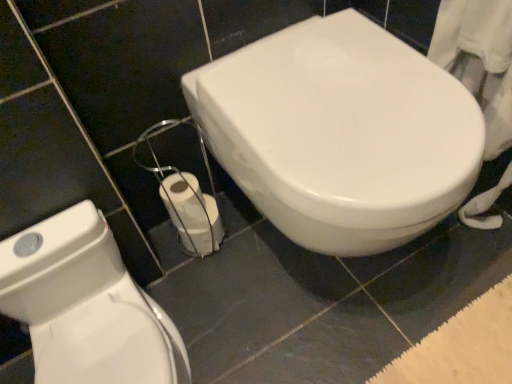
Question: Is white glossy toilet at lower left, the 2th toilet when ordered from right to left, bigger than white glossy toilet at center, the 2th toilet from the left?

Choices:
 (A) yes
 (B) no

Answer: (B)

Question: Is white glossy toilet at lower left, the 2th toilet when ordered from right to left, wider than white glossy toilet at center, acting as the 1th toilet starting from the right?

Choices:
 (A) no
 (B) yes

Answer: (A)

Question: From the image's perspective, would you say white glossy toilet at lower left, the 2th toilet when ordered from right to left, is positioned over white glossy toilet at center, acting as the 1th toilet starting from the right?

Choices:
 (A) yes
 (B) no

Answer: (B)

Question: Is white glossy toilet at center, the 2th toilet from the left, a part of white glossy toilet at lower left, acting as the 1th toilet starting from the left?

Choices:
 (A) no
 (B) yes

Answer: (A)

Question: Is white glossy toilet at lower left, acting as the 1th toilet starting from the left, thinner than white glossy toilet at center, the 2th toilet from the left?

Choices:
 (A) no
 (B) yes

Answer: (B)

Question: Is point (323, 144) positioned closer to the camera than point (172, 210)?

Choices:
 (A) farther
 (B) closer

Answer: (B)

Question: Is white glossy toilet at center, the 2th toilet from the left, bigger or smaller than white matte toilet paper at lower center?

Choices:
 (A) big
 (B) small

Answer: (A)

Question: In terms of height, does white glossy toilet at center, the 2th toilet from the left, look taller or shorter compared to white matte toilet paper at lower center?

Choices:
 (A) short
 (B) tall

Answer: (B)

Question: Is white glossy toilet at center, acting as the 1th toilet starting from the right, inside or outside of white matte toilet paper at lower center?

Choices:
 (A) outside
 (B) inside

Answer: (A)

Question: Based on their sizes in the image, would you say white matte toilet paper at lower center is bigger or smaller than white glossy toilet at lower left, the 2th toilet when ordered from right to left?

Choices:
 (A) big
 (B) small

Answer: (B)

Question: Considering the positions of white matte toilet paper at lower center and white glossy toilet at lower left, the 2th toilet when ordered from right to left, in the image, is white matte toilet paper at lower center wider or thinner than white glossy toilet at lower left, the 2th toilet when ordered from right to left,?

Choices:
 (A) thin
 (B) wide

Answer: (A)

Question: From a real-world perspective, is white matte toilet paper at lower center positioned above or below white glossy toilet at lower left, the 2th toilet when ordered from right to left?

Choices:
 (A) above
 (B) below

Answer: (B)

Question: Considering the positions of point (180, 225) and point (39, 312), is point (180, 225) closer or farther from the camera than point (39, 312)?

Choices:
 (A) closer
 (B) farther

Answer: (B)

Question: Considering their positions, is white glossy toilet at lower left, acting as the 1th toilet starting from the left, located in front of or behind white glossy toilet at center, acting as the 1th toilet starting from the right?

Choices:
 (A) front
 (B) behind

Answer: (A)

Question: In the image, is white glossy toilet at lower left, the 2th toilet when ordered from right to left, on the left side or the right side of white glossy toilet at center, acting as the 1th toilet starting from the right?

Choices:
 (A) right
 (B) left

Answer: (B)